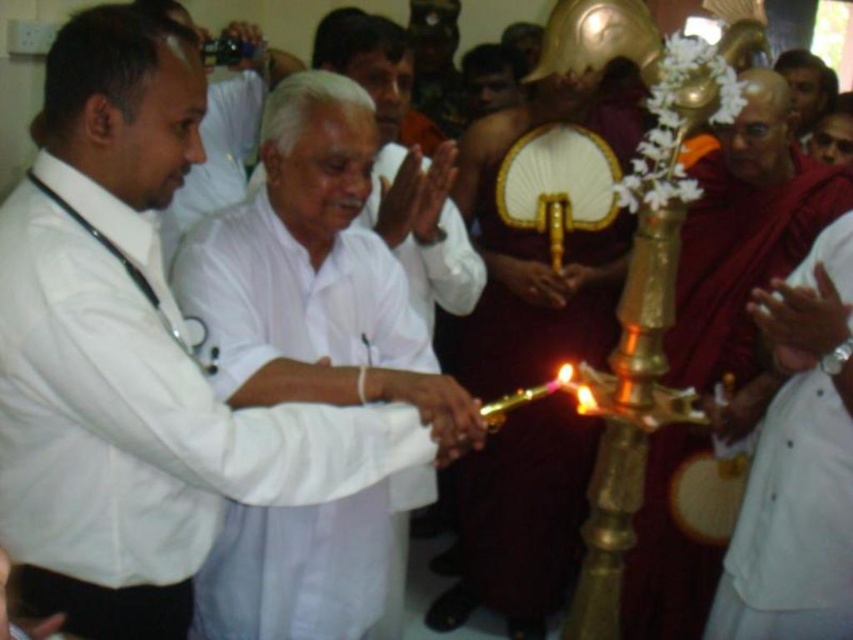
Between point (532, 452) and point (368, 628), which one is positioned behind?

The point (532, 452) is more distant.

Who is taller, shiny gold ceremonial staff at center or white cotton robe at center?

With more height is shiny gold ceremonial staff at center.

Where is `shiny gold ceremonial staff at center`? This screenshot has width=853, height=640. shiny gold ceremonial staff at center is located at coordinates (541, 244).

The height and width of the screenshot is (640, 853). I want to click on shiny gold ceremonial staff at center, so click(541, 244).

Does white matte shirt at center appear over shiny gold ceremonial staff at center?

No, white matte shirt at center is not above shiny gold ceremonial staff at center.

Between point (91, 12) and point (471, 540), which one is positioned in front?

Point (91, 12) is in front.

What are the coordinates of `white matte shirt at center` in the screenshot? It's located at (131, 349).

Is point (306, 436) closer to camera compared to point (265, 564)?

Yes, point (306, 436) is closer to viewer.

Does white matte shirt at center come in front of white cotton robe at center?

Yes, it is in front of white cotton robe at center.

Between point (152, 248) and point (334, 579), which one is positioned behind?

Positioned behind is point (334, 579).

Find the location of a particular element. The width and height of the screenshot is (853, 640). white matte shirt at center is located at coordinates (131, 349).